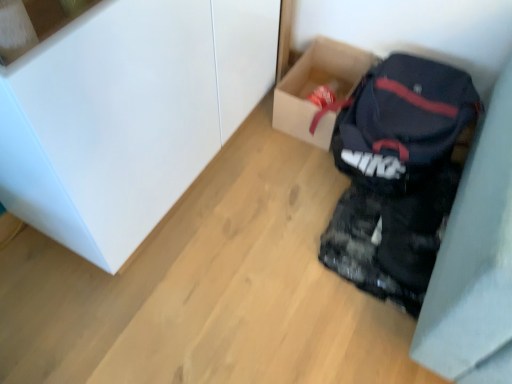
Question: From a real-world perspective, is white glossy cabinet at upper left beneath matte black backpack at lower right?

Choices:
 (A) no
 (B) yes

Answer: (A)

Question: Can you confirm if white glossy cabinet at upper left is thinner than matte black backpack at lower right?

Choices:
 (A) yes
 (B) no

Answer: (A)

Question: Can you confirm if white glossy cabinet at upper left is shorter than matte black backpack at lower right?

Choices:
 (A) yes
 (B) no

Answer: (B)

Question: Can you confirm if white glossy cabinet at upper left is taller than matte black backpack at lower right?

Choices:
 (A) yes
 (B) no

Answer: (A)

Question: Is white glossy cabinet at upper left directly adjacent to matte black backpack at lower right?

Choices:
 (A) no
 (B) yes

Answer: (A)

Question: Is white glossy cabinet at upper left not close to matte black backpack at lower right?

Choices:
 (A) yes
 (B) no

Answer: (B)

Question: Is cardboard box at center positioned beyond the bounds of matte black backpack at lower right?

Choices:
 (A) yes
 (B) no

Answer: (A)

Question: Is cardboard box at center facing towards matte black backpack at lower right?

Choices:
 (A) yes
 (B) no

Answer: (B)

Question: Is cardboard box at center to the right of matte black backpack at lower right from the viewer's perspective?

Choices:
 (A) yes
 (B) no

Answer: (B)

Question: Considering the relative sizes of cardboard box at center and matte black backpack at lower right in the image provided, is cardboard box at center taller than matte black backpack at lower right?

Choices:
 (A) yes
 (B) no

Answer: (B)

Question: From a real-world perspective, does cardboard box at center stand above matte black backpack at lower right?

Choices:
 (A) no
 (B) yes

Answer: (A)

Question: Is cardboard box at center positioned far away from matte black backpack at lower right?

Choices:
 (A) yes
 (B) no

Answer: (B)

Question: Can you see matte black backpack at lower right touching cardboard box at center?

Choices:
 (A) yes
 (B) no

Answer: (B)